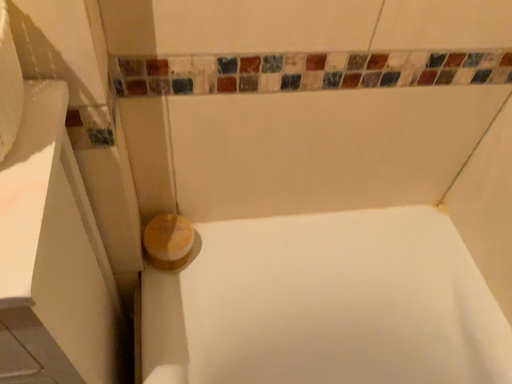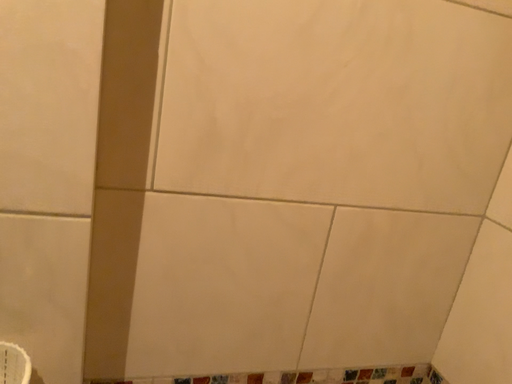
Question: How did the camera likely rotate when shooting the video?

Choices:
 (A) rotated upward
 (B) rotated downward

Answer: (A)